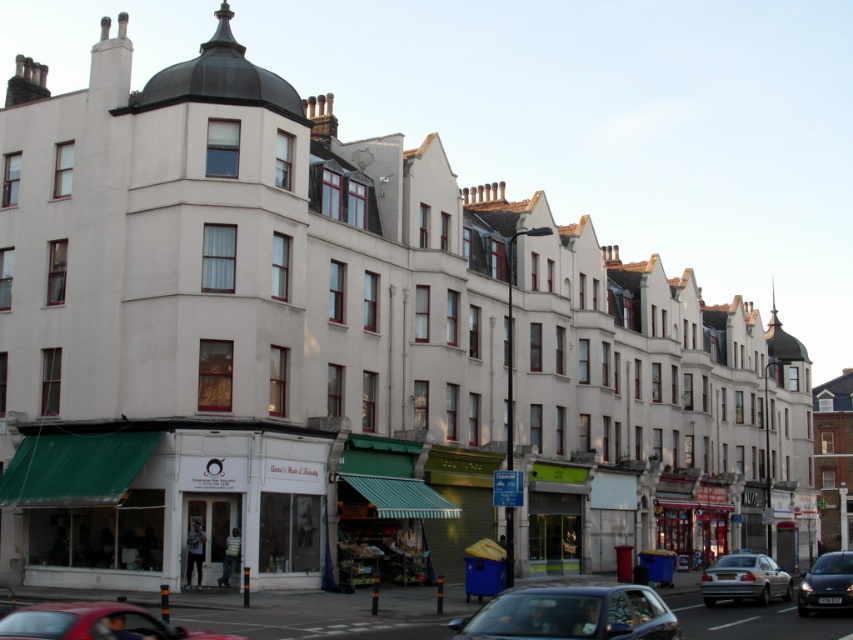
Who is positioned more to the left, green awning at lower left or metallic silver car at center?

green awning at lower left is more to the left.

Where is `green awning at lower left`? The width and height of the screenshot is (853, 640). green awning at lower left is located at coordinates (163, 502).

Is point (138, 580) more distant than point (746, 556)?

No, it is in front of (746, 556).

Between green awning at lower left and silver metallic sedan at lower right, which one has more height?

green awning at lower left is taller.

Who is more forward, [183,500] or [751,595]?

Positioned in front is point [183,500].

Where is `green awning at lower left`? green awning at lower left is located at coordinates (163, 502).

Is metallic silver car at center to the right of shiny black car at lower right from the viewer's perspective?

Incorrect, metallic silver car at center is not on the right side of shiny black car at lower right.

Between metallic silver car at center and shiny black car at lower right, which one has more height?

metallic silver car at center

What do you see at coordinates (572, 614) in the screenshot?
I see `metallic silver car at center` at bounding box center [572, 614].

The height and width of the screenshot is (640, 853). Find the location of `metallic silver car at center`. metallic silver car at center is located at coordinates (572, 614).